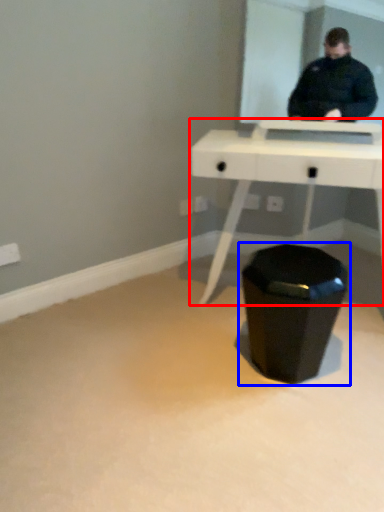
Question: Which object is further to the camera taking this photo, table (highlighted by a red box) or waste container (highlighted by a blue box)?

Choices:
 (A) table
 (B) waste container

Answer: (B)